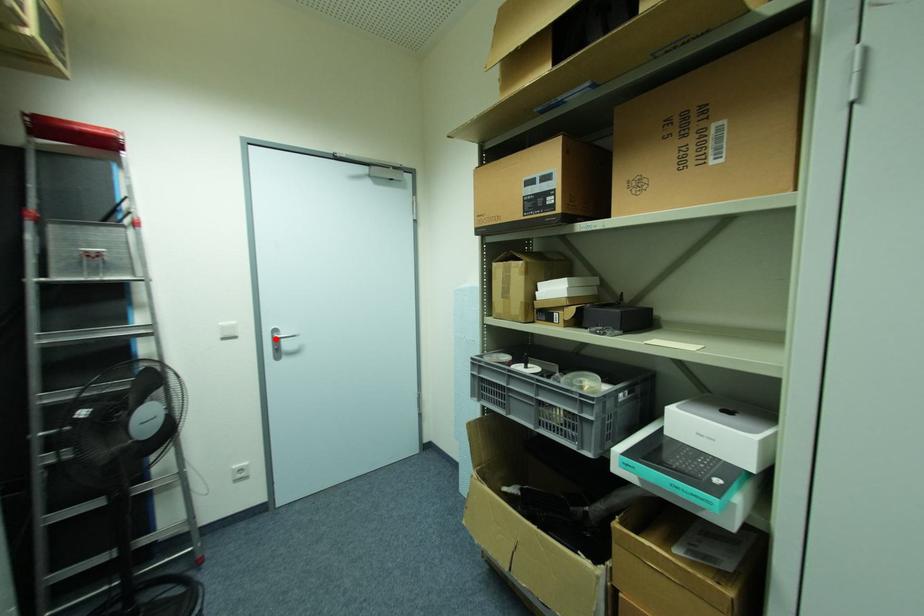
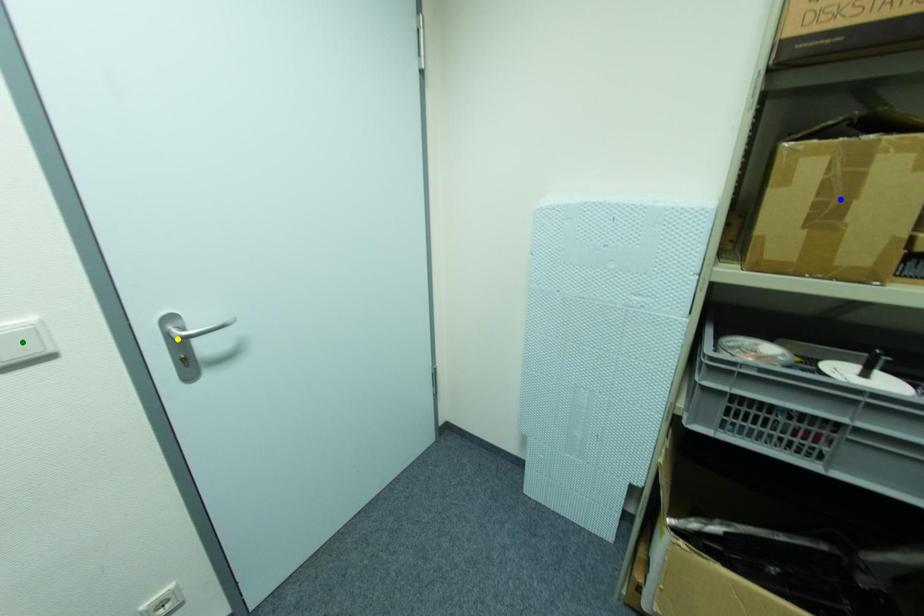
Question: I am providing you with two images of the same scene from different viewpoints. A red point is marked on the first image. You are given multiple points on the second image. Which point in image 2 represents the same 3d spot as the red point in image 1?

Choices:
 (A) green point
 (B) blue point
 (C) yellow point

Answer: (C)